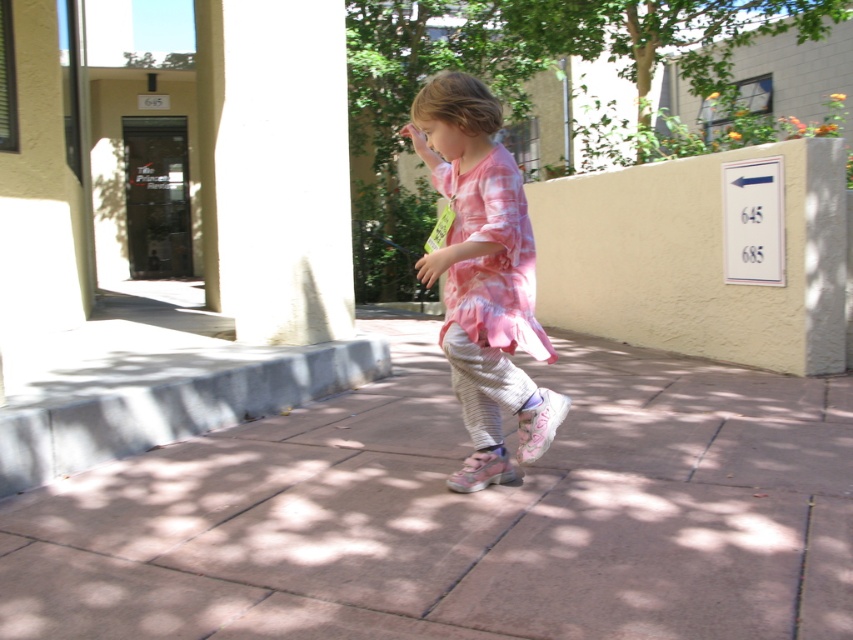
Question: Which point is farther to the camera?

Choices:
 (A) pink rubber shoes at center
 (B) pink fabric sandal at center
 (C) pink tie-dye dress at center

Answer: (B)

Question: Can you confirm if white smooth pillar at left is positioned to the right of pink tie-dye shirt at center?

Choices:
 (A) yes
 (B) no

Answer: (B)

Question: Estimate the real-world distances between objects in this image. Which object is closer to the pink tie-dye dress at center?

Choices:
 (A) pink fabric sandal at center
 (B) pink rubber shoes at center
 (C) pink tie-dye shirt at center
 (D) white smooth pillar at left

Answer: (C)

Question: Does pink tie-dye shirt at center have a larger size compared to pink tie-dye dress at center?

Choices:
 (A) no
 (B) yes

Answer: (B)

Question: Which point is farther to the camera?

Choices:
 (A) white smooth pillar at left
 (B) pink rubber shoes at center
 (C) pink fabric sandal at center
 (D) pink tie-dye shirt at center

Answer: (A)

Question: Is pink tie-dye dress at center further to camera compared to pink fabric sandal at center?

Choices:
 (A) yes
 (B) no

Answer: (B)